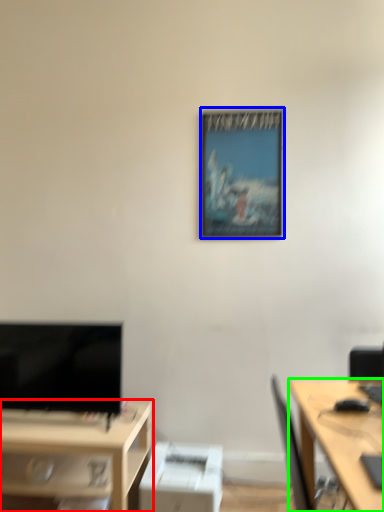
Question: Based on their relative distances, which object is farther from desk (highlighted by a red box)? Choose from picture frame (highlighted by a blue box) and desk (highlighted by a green box).

Choices:
 (A) picture frame
 (B) desk

Answer: (A)